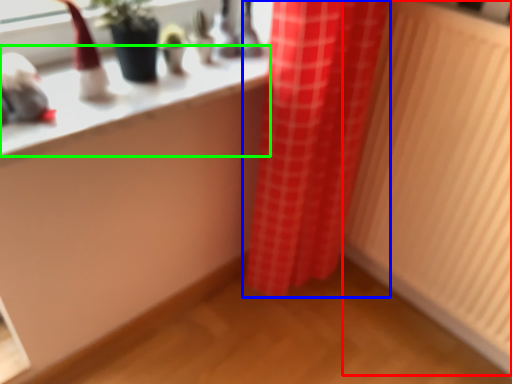
Question: Estimate the real-world distances between objects in this image. Which object is closer to radiator (highlighted by a red box), curtain (highlighted by a blue box) or counter top (highlighted by a green box)?

Choices:
 (A) curtain
 (B) counter top

Answer: (A)